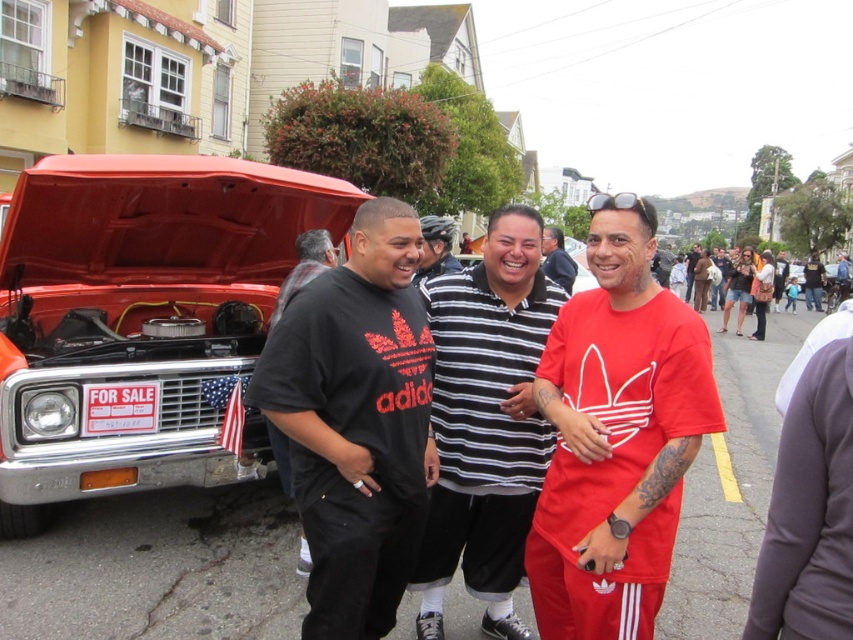
Question: Based on their relative distances, which object is farther from the shiny red car at left?

Choices:
 (A) black striped shirt at center
 (B) red matte shirt at center

Answer: (B)

Question: Can you confirm if black matte adidas shirt at center is thinner than black striped shirt at center?

Choices:
 (A) yes
 (B) no

Answer: (B)

Question: Can you confirm if black matte adidas shirt at center is thinner than black striped shirt at center?

Choices:
 (A) no
 (B) yes

Answer: (A)

Question: Among these points, which one is farthest from the camera?

Choices:
 (A) (444, 269)
 (B) (51, 349)

Answer: (A)

Question: Which is nearer to the red matte shirt at center?

Choices:
 (A) black striped shirt at center
 (B) shiny red car at left
 (C) dark gray shirt at left
 (D) striped cotton shirt at center

Answer: (A)

Question: Is red matte adidas shirt at center further to camera compared to striped cotton shirt at center?

Choices:
 (A) no
 (B) yes

Answer: (A)